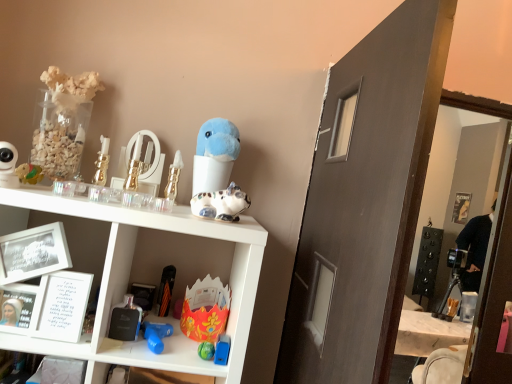
Question: From a real-world perspective, does shiny plastic toy at left, positioned as the 11th toy in right-to-left order, sit lower than blue plastic toy at lower center, the first toy when ordered from right to left?

Choices:
 (A) no
 (B) yes

Answer: (A)

Question: Can you confirm if shiny plastic toy at left, positioned as the 11th toy in right-to-left order, is thinner than blue plastic toy at lower center, the 11th toy when ordered from left to right?

Choices:
 (A) yes
 (B) no

Answer: (B)

Question: Is shiny plastic toy at left, positioned as the 11th toy in right-to-left order, wider than blue plastic toy at lower center, the first toy when ordered from right to left?

Choices:
 (A) no
 (B) yes

Answer: (B)

Question: Is shiny plastic toy at left, positioned as the 11th toy in right-to-left order, not close to blue plastic toy at lower center, the 11th toy when ordered from left to right?

Choices:
 (A) yes
 (B) no

Answer: (B)

Question: From the image's perspective, is shiny plastic toy at left, acting as the first toy starting from the left, under blue plastic toy at lower center, the first toy when ordered from right to left?

Choices:
 (A) yes
 (B) no

Answer: (B)

Question: From a real-world perspective, is shiny plastic toy at left, positioned as the 11th toy in right-to-left order, positioned over blue plastic toy at lower center, the first toy when ordered from right to left, based on gravity?

Choices:
 (A) no
 (B) yes

Answer: (B)

Question: Considering the relative sizes of metallic gold perfume bottle at center, the 6th toy when ordered from left to right, and shiny green ball at lower center, which is counted as the 3th toy, starting from the right, in the image provided, is metallic gold perfume bottle at center, the 6th toy when ordered from left to right, smaller than shiny green ball at lower center, which is counted as the 3th toy, starting from the right,?

Choices:
 (A) yes
 (B) no

Answer: (B)

Question: Is metallic gold perfume bottle at center, the 6th toy when ordered from left to right, wider than shiny green ball at lower center, which is counted as the 3th toy, starting from the right?

Choices:
 (A) no
 (B) yes

Answer: (A)

Question: Considering the relative sizes of metallic gold perfume bottle at center, arranged as the sixth toy when viewed from the right, and shiny green ball at lower center, marked as the ninth toy in a left-to-right arrangement, in the image provided, is metallic gold perfume bottle at center, arranged as the sixth toy when viewed from the right, bigger than shiny green ball at lower center, marked as the ninth toy in a left-to-right arrangement,?

Choices:
 (A) no
 (B) yes

Answer: (B)

Question: Is metallic gold perfume bottle at center, arranged as the sixth toy when viewed from the right, shorter than shiny green ball at lower center, which is counted as the 3th toy, starting from the right?

Choices:
 (A) no
 (B) yes

Answer: (A)

Question: From a real-world perspective, is metallic gold perfume bottle at center, the 6th toy when ordered from left to right, over shiny green ball at lower center, marked as the ninth toy in a left-to-right arrangement?

Choices:
 (A) no
 (B) yes

Answer: (B)

Question: Is metallic gold perfume bottle at center, the 6th toy when ordered from left to right, further to camera compared to shiny green ball at lower center, which is counted as the 3th toy, starting from the right?

Choices:
 (A) yes
 (B) no

Answer: (A)

Question: Can you confirm if shiny plastic toy at left, acting as the first toy starting from the left, is bigger than floral paper crown at center, which is the fifth toy in right-to-left order?

Choices:
 (A) yes
 (B) no

Answer: (B)